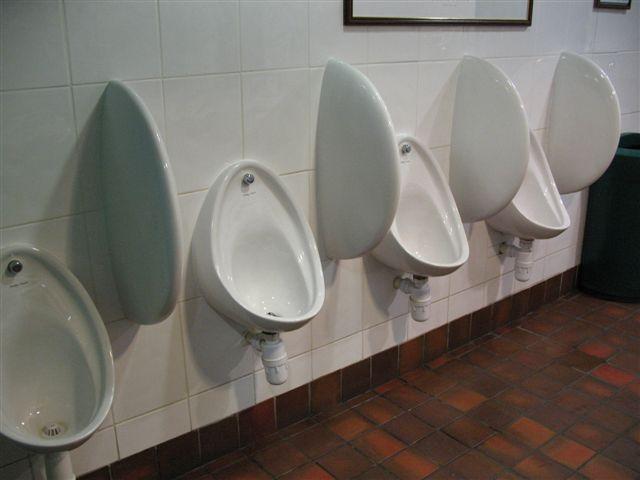
The image size is (640, 480). Identify the location of picture. (404, 7).